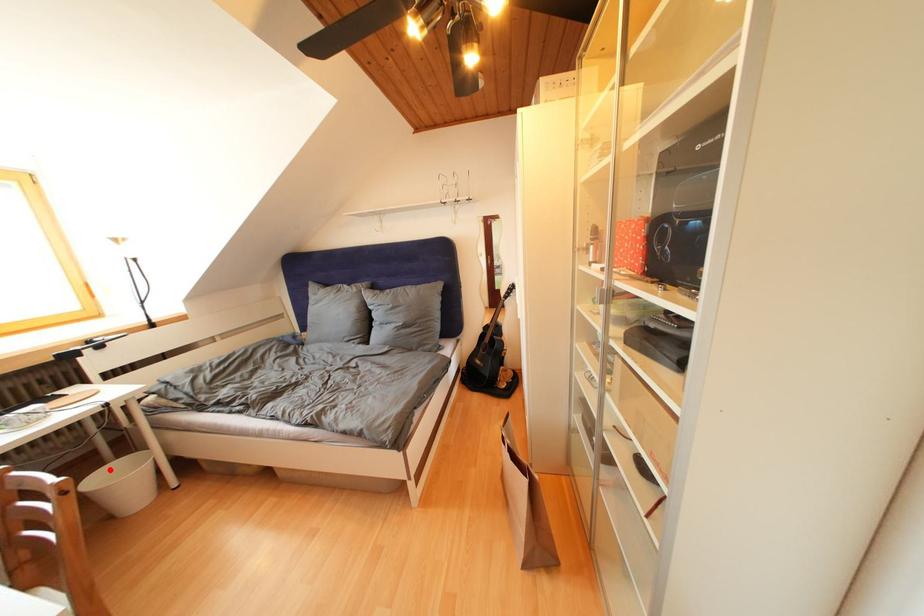
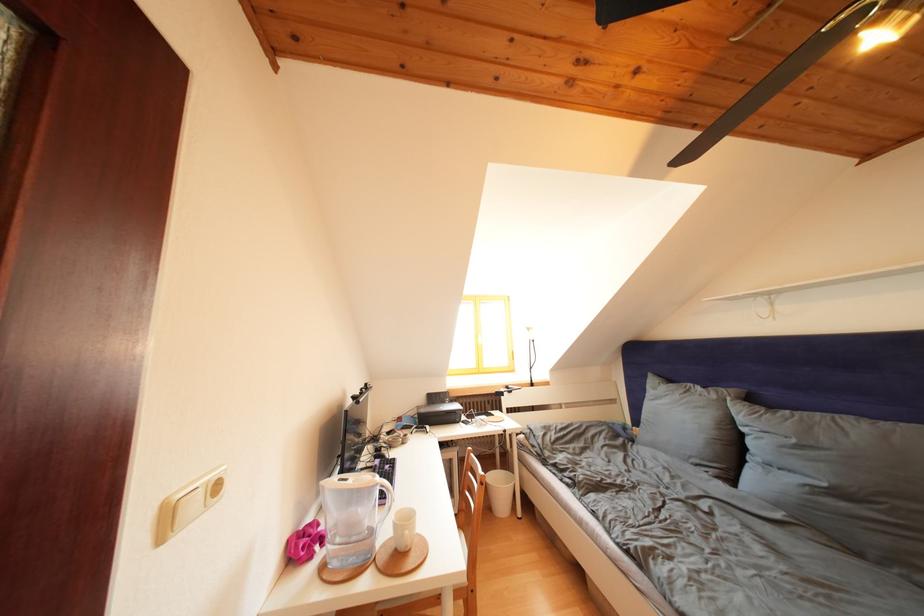
Question: A red point is marked in image1. In image2, is the corresponding 3D point closer to the camera or farther? Reply with the corresponding letter.

Choices:
 (A) The corresponding 3D point is closer.
 (B) The corresponding 3D point is farther.

Answer: (A)